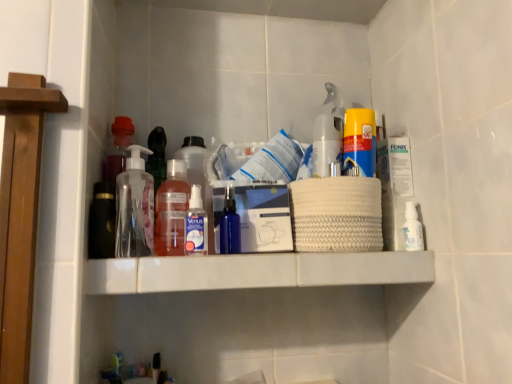
The image size is (512, 384). Describe the element at coordinates (412, 228) in the screenshot. I see `clear plastic spray bottle at right, acting as the 1th bottle starting from the right` at that location.

The image size is (512, 384). What do you see at coordinates (326, 143) in the screenshot?
I see `white matte spray can at center, which ranks as the fifth bottle in left-to-right order` at bounding box center [326, 143].

In order to face white matte spray can at center, which is counted as the 2th bottle, starting from the right, should I rotate leftwards or rightwards?

Rotate right and turn 10.086 degrees.

In order to click on white matte shelf at center in this screenshot , I will do `click(256, 271)`.

The width and height of the screenshot is (512, 384). Describe the element at coordinates (196, 164) in the screenshot. I see `translucent plastic bottle at center, which ranks as the 3th bottle in left-to-right order` at that location.

The width and height of the screenshot is (512, 384). In order to click on transparent plastic pump bottle at center, placed as the 6th bottle when sorted from right to left in this screenshot , I will do `click(134, 207)`.

Image resolution: width=512 pixels, height=384 pixels. Describe the element at coordinates (360, 141) in the screenshot. I see `yellow matte canister at upper center` at that location.

The width and height of the screenshot is (512, 384). I want to click on clear plastic spray bottle at center, positioned as the 3th bottle in right-to-left order, so click(x=196, y=224).

Which point is more distant from viewer, [416,234] or [197,187]?

The point [197,187] is farther.

Measure the distance from clear plastic spray bottle at right, the sixth bottle viewed from the left, to clear plastic spray bottle at center, positioned as the 3th bottle in right-to-left order.

clear plastic spray bottle at right, the sixth bottle viewed from the left, and clear plastic spray bottle at center, positioned as the 3th bottle in right-to-left order, are 14.68 inches apart.

Is clear plastic spray bottle at right, the sixth bottle viewed from the left, aimed at clear plastic spray bottle at center, positioned as the 3th bottle in right-to-left order?

No, clear plastic spray bottle at right, the sixth bottle viewed from the left, is not turned towards clear plastic spray bottle at center, positioned as the 3th bottle in right-to-left order.

Between clear plastic spray bottle at right, acting as the 1th bottle starting from the right, and clear plastic spray bottle at center, the fourth bottle viewed from the left, which one has larger size?

With larger size is clear plastic spray bottle at center, the fourth bottle viewed from the left.

Does transparent plastic pump bottle at center, placed as the 6th bottle when sorted from right to left, have a smaller size compared to white matte shelf at center?

Yes.

Between point (150, 228) and point (290, 277), which one is positioned behind?

Point (150, 228)

Does transparent plastic pump bottle at center, placed as the 6th bottle when sorted from right to left, lie in front of white matte shelf at center?

No, it is not.

Can you tell me how much transparent plastic pump bottle at center, placed as the 6th bottle when sorted from right to left, and white matte shelf at center differ in facing direction?

0.00432 degrees.

Is translucent plastic bottle at center, the 5th bottle in the right-to-left sequence, aimed at transparent plastic pump bottle at center, which is the first bottle in left-to-right order?

No, translucent plastic bottle at center, the 5th bottle in the right-to-left sequence, is not turned towards transparent plastic pump bottle at center, which is the first bottle in left-to-right order.

Is translucent plastic bottle at center, marked as the second bottle in a left-to-right arrangement, directly adjacent to transparent plastic pump bottle at center, placed as the 6th bottle when sorted from right to left?

Indeed, translucent plastic bottle at center, marked as the second bottle in a left-to-right arrangement, and transparent plastic pump bottle at center, placed as the 6th bottle when sorted from right to left, are beside each other and touching.

Is transparent plastic pump bottle at center, which is the first bottle in left-to-right order, located within translucent plastic bottle at center, marked as the second bottle in a left-to-right arrangement?

No, transparent plastic pump bottle at center, which is the first bottle in left-to-right order, is not inside translucent plastic bottle at center, marked as the second bottle in a left-to-right arrangement.

Between yellow matte canister at upper center and translucent plastic bottle at center, the 5th bottle in the right-to-left sequence, which one appears on the left side from the viewer's perspective?

From the viewer's perspective, translucent plastic bottle at center, the 5th bottle in the right-to-left sequence, appears more on the left side.

Considering the points (370, 148) and (160, 251), which point is in front, point (370, 148) or point (160, 251)?

The point (160, 251) is closer.

Consider the image. From a real-world perspective, is yellow matte canister at upper center physically located above or below translucent plastic bottle at center, marked as the second bottle in a left-to-right arrangement?

yellow matte canister at upper center is situated higher than translucent plastic bottle at center, marked as the second bottle in a left-to-right arrangement, in the real world.

Considering the relative sizes of yellow matte canister at upper center and translucent plastic bottle at center, marked as the second bottle in a left-to-right arrangement, in the image provided, is yellow matte canister at upper center thinner than translucent plastic bottle at center, marked as the second bottle in a left-to-right arrangement,?

No, yellow matte canister at upper center is not thinner than translucent plastic bottle at center, marked as the second bottle in a left-to-right arrangement.

Is point (369, 175) in front of point (405, 218)?

That is True.

Who is smaller, yellow matte canister at upper center or clear plastic spray bottle at right, acting as the 1th bottle starting from the right?

With smaller size is clear plastic spray bottle at right, acting as the 1th bottle starting from the right.

Is yellow matte canister at upper center oriented towards clear plastic spray bottle at right, the sixth bottle viewed from the left?

No, yellow matte canister at upper center is not oriented towards clear plastic spray bottle at right, the sixth bottle viewed from the left.

In terms of width, does yellow matte canister at upper center look wider or thinner when compared to clear plastic spray bottle at right, the sixth bottle viewed from the left?

In the image, yellow matte canister at upper center appears to be wider than clear plastic spray bottle at right, the sixth bottle viewed from the left.

Who is shorter, clear plastic spray bottle at right, acting as the 1th bottle starting from the right, or translucent plastic bottle at center, the 5th bottle in the right-to-left sequence?

Standing shorter between the two is clear plastic spray bottle at right, acting as the 1th bottle starting from the right.

Would you say clear plastic spray bottle at right, the sixth bottle viewed from the left, contains translucent plastic bottle at center, the 5th bottle in the right-to-left sequence?

No, translucent plastic bottle at center, the 5th bottle in the right-to-left sequence, is not a part of clear plastic spray bottle at right, the sixth bottle viewed from the left.

Is clear plastic spray bottle at right, acting as the 1th bottle starting from the right, next to translucent plastic bottle at center, marked as the second bottle in a left-to-right arrangement?

No, clear plastic spray bottle at right, acting as the 1th bottle starting from the right, is not beside translucent plastic bottle at center, marked as the second bottle in a left-to-right arrangement.

Considering the positions of objects clear plastic spray bottle at center, the fourth bottle viewed from the left, and white matte shelf at center in the image provided, who is more to the right, clear plastic spray bottle at center, the fourth bottle viewed from the left, or white matte shelf at center?

white matte shelf at center is more to the right.

Does clear plastic spray bottle at center, positioned as the 3th bottle in right-to-left order, have a lesser width compared to white matte shelf at center?

Yes, clear plastic spray bottle at center, positioned as the 3th bottle in right-to-left order, is thinner than white matte shelf at center.

Can we say clear plastic spray bottle at center, positioned as the 3th bottle in right-to-left order, lies outside white matte shelf at center?

Yes, clear plastic spray bottle at center, positioned as the 3th bottle in right-to-left order, is outside of white matte shelf at center.

Is clear plastic spray bottle at center, positioned as the 3th bottle in right-to-left order, closer to the viewer compared to white matte shelf at center?

No, it is behind white matte shelf at center.

This screenshot has width=512, height=384. Find the location of `the 4th bottle behind the clear plastic spray bottle at center, the fourth bottle viewed from the left`. the 4th bottle behind the clear plastic spray bottle at center, the fourth bottle viewed from the left is located at coordinates [x=412, y=228].

There is a white matte shelf at center. Where is `the 4th bottle above it (from a real-world perspective)`? This screenshot has height=384, width=512. the 4th bottle above it (from a real-world perspective) is located at coordinates (134, 207).

Considering their positions, is yellow matte canister at upper center positioned closer to white matte spray can at center, which ranks as the fifth bottle in left-to-right order, than translucent plastic bottle at center, marked as the second bottle in a left-to-right arrangement?

yellow matte canister at upper center.

Estimate the real-world distances between objects in this image. Which object is closer to white matte spray can at center, which is counted as the 2th bottle, starting from the right, clear plastic spray bottle at center, positioned as the 3th bottle in right-to-left order, or clear plastic spray bottle at right, acting as the 1th bottle starting from the right?

The object closer to white matte spray can at center, which is counted as the 2th bottle, starting from the right, is clear plastic spray bottle at right, acting as the 1th bottle starting from the right.

When comparing their distances from yellow matte canister at upper center, does clear plastic spray bottle at center, positioned as the 3th bottle in right-to-left order, or clear plastic spray bottle at right, acting as the 1th bottle starting from the right, seem further?

Among the two, clear plastic spray bottle at center, positioned as the 3th bottle in right-to-left order, is located further to yellow matte canister at upper center.

Considering their positions, is white matte spray can at center, which is counted as the 2th bottle, starting from the right, positioned closer to clear plastic spray bottle at center, the fourth bottle viewed from the left, than clear plastic spray bottle at right, acting as the 1th bottle starting from the right?

white matte spray can at center, which is counted as the 2th bottle, starting from the right, is closer to clear plastic spray bottle at center, the fourth bottle viewed from the left.

Which object lies further to the anchor point translucent plastic bottle at center, the 5th bottle in the right-to-left sequence, clear plastic spray bottle at center, positioned as the 3th bottle in right-to-left order, or transparent plastic pump bottle at center, which is the first bottle in left-to-right order?

transparent plastic pump bottle at center, which is the first bottle in left-to-right order, is further to translucent plastic bottle at center, the 5th bottle in the right-to-left sequence.

Estimate the real-world distances between objects in this image. Which object is further from white matte spray can at center, which ranks as the fifth bottle in left-to-right order, clear plastic spray bottle at right, acting as the 1th bottle starting from the right, or translucent plastic bottle at center, marked as the second bottle in a left-to-right arrangement?

translucent plastic bottle at center, marked as the second bottle in a left-to-right arrangement.

Considering their positions, is clear plastic spray bottle at right, acting as the 1th bottle starting from the right, positioned closer to translucent plastic bottle at center, the 5th bottle in the right-to-left sequence, than white matte spray can at center, which is counted as the 2th bottle, starting from the right?

Among the two, white matte spray can at center, which is counted as the 2th bottle, starting from the right, is located nearer to translucent plastic bottle at center, the 5th bottle in the right-to-left sequence.

Looking at this image, which object lies nearer to the anchor point transparent plastic pump bottle at center, which is the first bottle in left-to-right order, clear plastic spray bottle at right, the sixth bottle viewed from the left, or white matte shelf at center?

white matte shelf at center lies closer to transparent plastic pump bottle at center, which is the first bottle in left-to-right order, than the other object.

This screenshot has width=512, height=384. What are the coordinates of `shelf between translucent plastic bottle at center, which ranks as the 3th bottle in left-to-right order, and clear plastic spray bottle at right, acting as the 1th bottle starting from the right` in the screenshot? It's located at (256, 271).

At what (x,y) coordinates should I click in order to perform the action: click on shelf between translucent plastic bottle at center, marked as the second bottle in a left-to-right arrangement, and clear plastic spray bottle at right, acting as the 1th bottle starting from the right, from left to right. Please return your answer as a coordinate pair (x, y). Looking at the image, I should click on (256, 271).

Where is `bottle located between clear plastic spray bottle at center, positioned as the 3th bottle in right-to-left order, and clear plastic spray bottle at right, the sixth bottle viewed from the left, in the left-right direction`? bottle located between clear plastic spray bottle at center, positioned as the 3th bottle in right-to-left order, and clear plastic spray bottle at right, the sixth bottle viewed from the left, in the left-right direction is located at coordinates 326,143.

The image size is (512, 384). Identify the location of shelf between translucent plastic bottle at center, the 5th bottle in the right-to-left sequence, and white matte spray can at center, which is counted as the 2th bottle, starting from the right, from left to right. (256, 271).